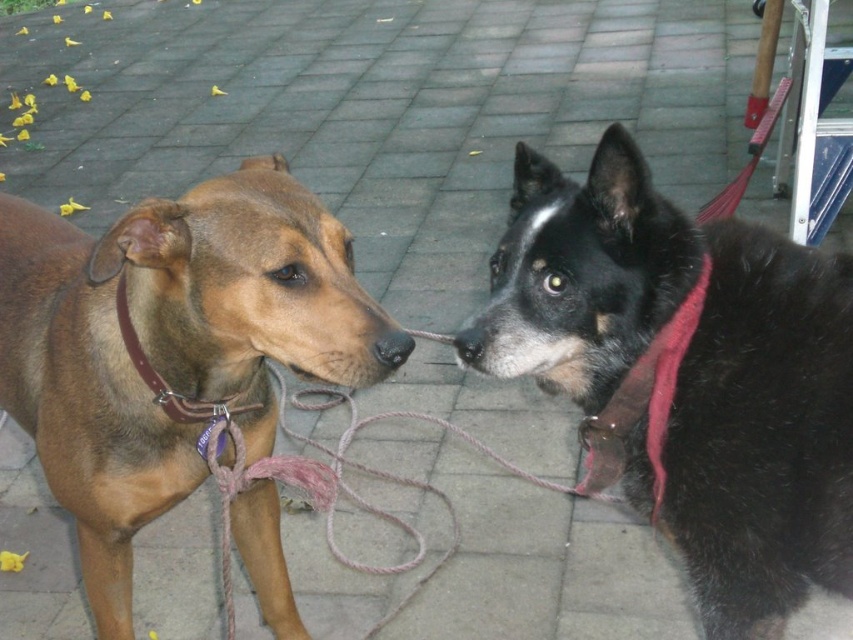
Is brown matte dog at left thinner than red fabric neckband at right?

No.

Does brown matte dog at left have a lesser height compared to red fabric neckband at right?

No.

Locate an element on the screen. The width and height of the screenshot is (853, 640). brown matte dog at left is located at coordinates (171, 346).

In order to click on brown matte dog at left in this screenshot , I will do `click(171, 346)`.

Is black fur dog at center shorter than red fabric neckband at right?

Incorrect, black fur dog at center's height does not fall short of red fabric neckband at right's.

Is black fur dog at center smaller than red fabric neckband at right?

No, black fur dog at center is not smaller than red fabric neckband at right.

Does point (773, 392) come in front of point (706, 282)?

Yes, it is.

Identify the location of black fur dog at center. pos(691,371).

Can you confirm if black fur dog at center is smaller than brown matte dog at left?

Indeed, black fur dog at center has a smaller size compared to brown matte dog at left.

How far apart are black fur dog at center and brown matte dog at left?

black fur dog at center and brown matte dog at left are 17.30 inches apart from each other.

Identify the location of black fur dog at center. (691, 371).

This screenshot has width=853, height=640. I want to click on black fur dog at center, so click(691, 371).